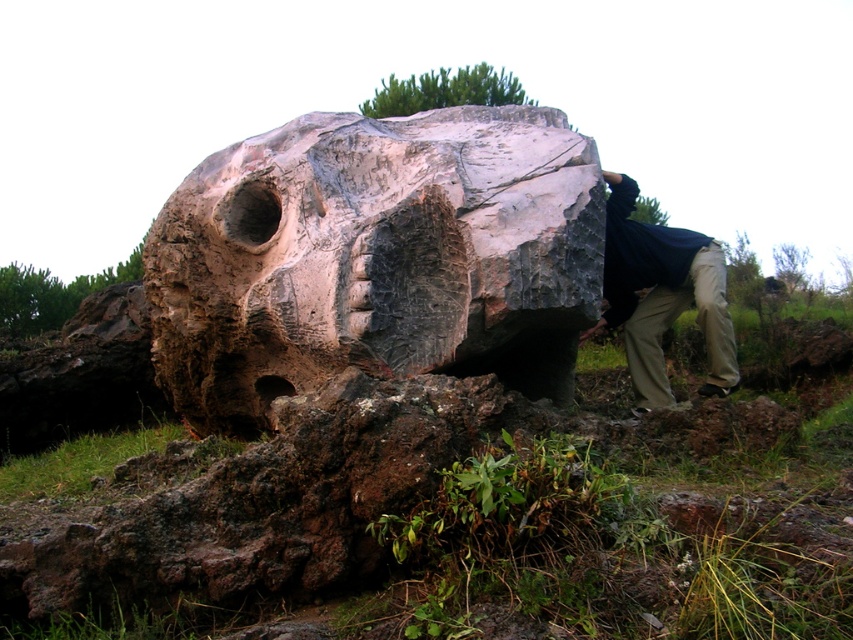
Which is in front, point (463, 321) or point (637, 307)?

Point (463, 321)

Who is taller, rustic stone sculpture at center or khaki cotton pants at center?

rustic stone sculpture at center

Locate an element on the screen. rustic stone sculpture at center is located at coordinates (376, 259).

Between point (708, 266) and point (653, 310), which one is positioned behind?

The point (653, 310) is behind.

Does khaki cotton pants at center lie in front of khaki pants at lower right?

Yes, it is.

The width and height of the screenshot is (853, 640). Find the location of `khaki cotton pants at center`. khaki cotton pants at center is located at coordinates pyautogui.click(x=662, y=294).

Which is more to the left, rustic stone sculpture at center or khaki pants at lower right?

rustic stone sculpture at center

Which of these two, rustic stone sculpture at center or khaki pants at lower right, stands shorter?

khaki pants at lower right

The image size is (853, 640). Identify the location of rustic stone sculpture at center. (376, 259).